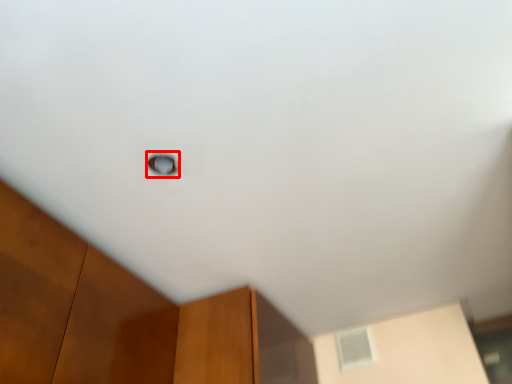
Question: Observing the image, what is the correct spatial positioning of window (annotated by the red box) in reference to window?

Choices:
 (A) left
 (B) right

Answer: (A)